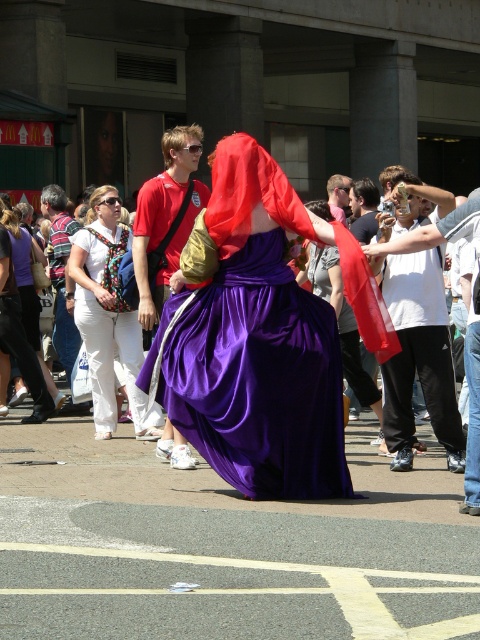
Question: Which of the following is the farthest from the observer?

Choices:
 (A) matte white pants at lower left
 (B) matte white pants at center

Answer: (A)

Question: In this image, where is purple satin dress at center located relative to matte white pants at lower left?

Choices:
 (A) left
 (B) right

Answer: (B)

Question: Which of these objects is positioned farthest from the matte white pants at lower left?

Choices:
 (A) purple satin dress at center
 (B) matte white pants at center

Answer: (A)

Question: Which object is closer to the camera taking this photo?

Choices:
 (A) matte white pants at lower left
 (B) purple satin dress at center
 (C) satin purple dress at center
 (D) matte white pants at center

Answer: (C)

Question: Is matte white pants at center closer to the viewer compared to matte white pants at lower left?

Choices:
 (A) yes
 (B) no

Answer: (A)

Question: Can you confirm if satin purple dress at center is smaller than purple satin dress at center?

Choices:
 (A) no
 (B) yes

Answer: (A)